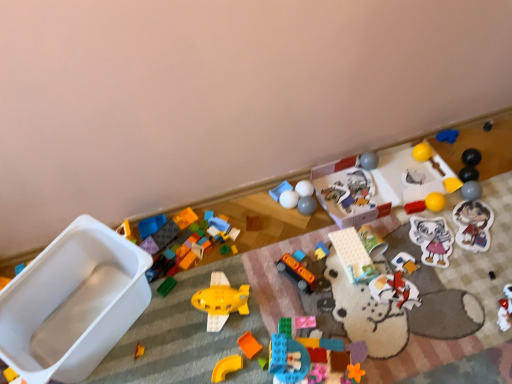
You are a GUI agent. You are given a task and a screenshot of the screen. Output one action in this format:
    pyautogui.click(x=<x>, y=<y>)
    Task: Click on the unoccupied area behind white matte figure at center, placed as the seventh toy when sorted from right to left
    This screenshot has height=384, width=512.
    Given the screenshot: What is the action you would take?
    pyautogui.click(x=389, y=232)